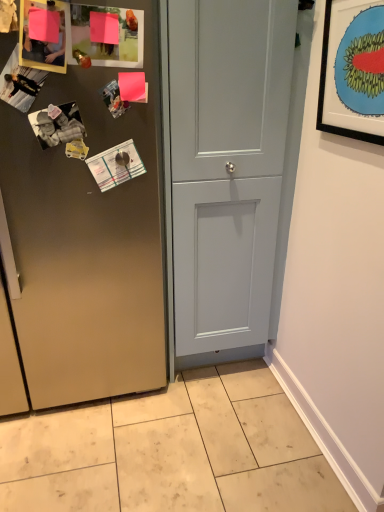
Question: Should I look upward or downward to see light gray wood door at center, the first door positioned from the right?

Choices:
 (A) down
 (B) up

Answer: (B)

Question: Are satin finish cabinet at center, which is the 2th door in right-to-left order, and black matte picture frame at upper right making contact?

Choices:
 (A) yes
 (B) no

Answer: (B)

Question: Is satin finish cabinet at center, which is the 2th door in right-to-left order, not near black matte picture frame at upper right?

Choices:
 (A) yes
 (B) no

Answer: (B)

Question: Does satin finish cabinet at center, the first door in the left-to-right sequence, have a lesser width compared to black matte picture frame at upper right?

Choices:
 (A) no
 (B) yes

Answer: (A)

Question: From a real-world perspective, is satin finish cabinet at center, the first door in the left-to-right sequence, physically above black matte picture frame at upper right?

Choices:
 (A) yes
 (B) no

Answer: (B)

Question: Can you confirm if satin finish cabinet at center, the first door in the left-to-right sequence, is smaller than black matte picture frame at upper right?

Choices:
 (A) no
 (B) yes

Answer: (A)

Question: Is black matte picture frame at upper right surrounded by satin finish cabinet at center, which is the 2th door in right-to-left order?

Choices:
 (A) no
 (B) yes

Answer: (A)

Question: Is beige tile at lower center closer to the viewer compared to satin finish cabinet at center, the first door in the left-to-right sequence?

Choices:
 (A) no
 (B) yes

Answer: (A)

Question: Is beige tile at lower center shorter than satin finish cabinet at center, which is the 2th door in right-to-left order?

Choices:
 (A) yes
 (B) no

Answer: (A)

Question: Does beige tile at lower center lie behind satin finish cabinet at center, the first door in the left-to-right sequence?

Choices:
 (A) no
 (B) yes

Answer: (B)

Question: Considering the relative positions of beige tile at lower center and satin finish cabinet at center, which is the 2th door in right-to-left order, in the image provided, is beige tile at lower center to the right of satin finish cabinet at center, which is the 2th door in right-to-left order, from the viewer's perspective?

Choices:
 (A) no
 (B) yes

Answer: (B)

Question: Is beige tile at lower center oriented towards satin finish cabinet at center, which is the 2th door in right-to-left order?

Choices:
 (A) yes
 (B) no

Answer: (A)

Question: Is beige tile at lower center wider than satin finish cabinet at center, the first door in the left-to-right sequence?

Choices:
 (A) yes
 (B) no

Answer: (A)

Question: Could black matte picture frame at upper right be considered to be inside light gray wood door at center, the first door positioned from the right?

Choices:
 (A) yes
 (B) no

Answer: (B)